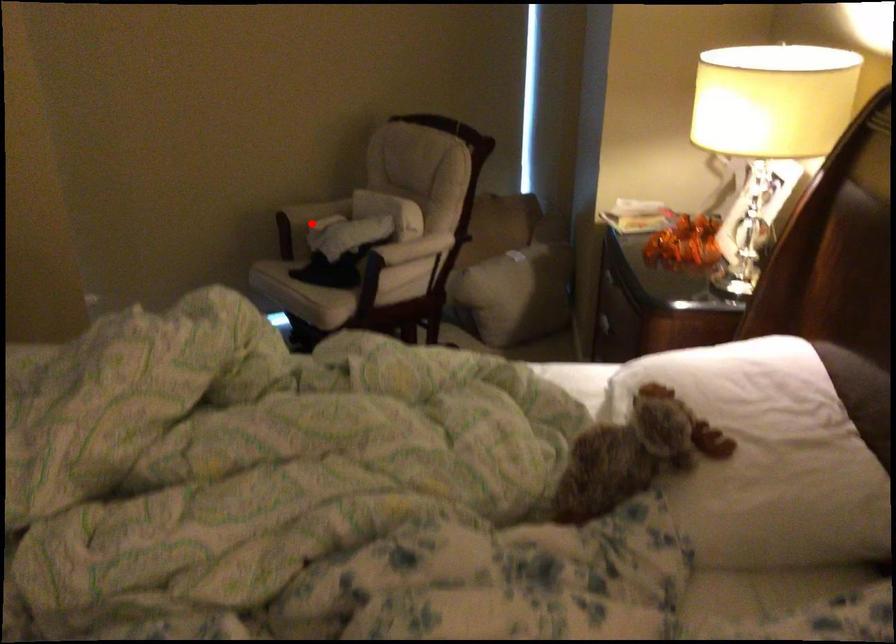
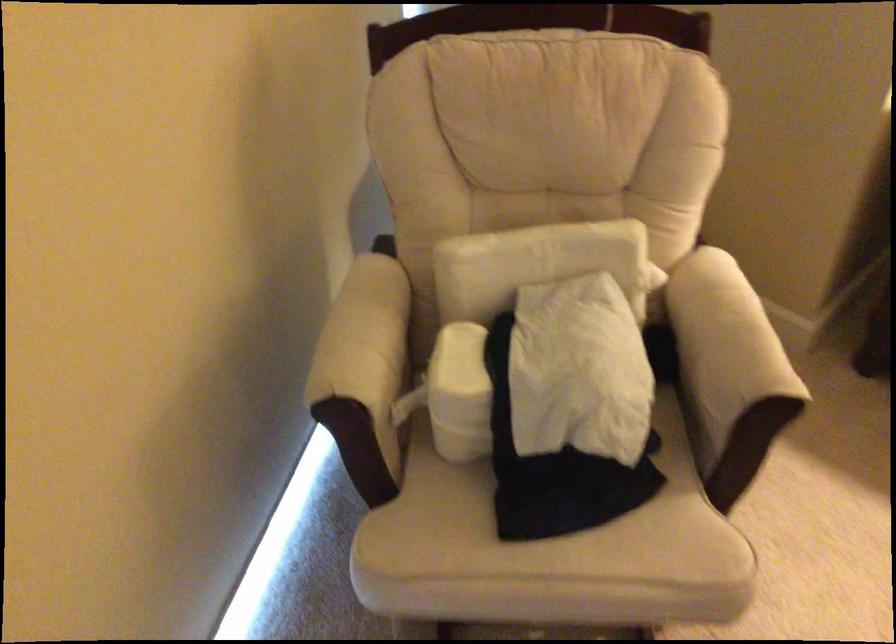
Question: A red point is marked in image1. In image2, is the corresponding 3D point closer to the camera or farther? Reply with the corresponding letter.

Choices:
 (A) The corresponding 3D point is closer.
 (B) The corresponding 3D point is farther.

Answer: (A)